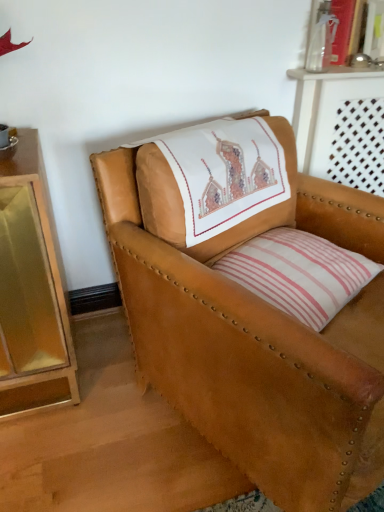
Find the location of a particular element. tan leather chair at center is located at coordinates (x=254, y=333).

Describe the element at coordinates (254, 333) in the screenshot. This screenshot has width=384, height=512. I see `tan leather chair at center` at that location.

Describe the element at coordinates (299, 273) in the screenshot. I see `white striped pillow at center` at that location.

Where is `white striped pillow at center`? white striped pillow at center is located at coordinates (299, 273).

Find the location of `tan leather chair at center`. tan leather chair at center is located at coordinates (254, 333).

Considering the relative positions of white striped pillow at center and tan leather chair at center in the image provided, is white striped pillow at center to the left of tan leather chair at center from the viewer's perspective?

In fact, white striped pillow at center is to the right of tan leather chair at center.

Between white striped pillow at center and tan leather chair at center, which one is positioned in front?

tan leather chair at center is more forward.

Which is in front, point (358, 287) or point (289, 361)?

Positioned in front is point (289, 361).

From the image's perspective, is white striped pillow at center located beneath tan leather chair at center?

No, from the image's perspective, white striped pillow at center is not beneath tan leather chair at center.

In the scene shown: From a real-world perspective, which is physically below, white striped pillow at center or tan leather chair at center?

tan leather chair at center, from a real-world perspective.

Considering the sizes of objects white striped pillow at center and tan leather chair at center in the image provided, who is thinner, white striped pillow at center or tan leather chair at center?

With smaller width is white striped pillow at center.

Does white striped pillow at center have a lesser height compared to tan leather chair at center?

Yes, white striped pillow at center is shorter than tan leather chair at center.

Looking at the image, does white striped pillow at center seem bigger or smaller compared to tan leather chair at center?

In the image, white striped pillow at center appears to be smaller than tan leather chair at center.

In the scene shown: Is white striped pillow at center positioned beyond the bounds of tan leather chair at center?

That's incorrect, white striped pillow at center is not completely outside tan leather chair at center.

Is white striped pillow at center next to tan leather chair at center and touching it?

No, white striped pillow at center is not touching tan leather chair at center.

Is white striped pillow at center oriented towards tan leather chair at center?

Yes, white striped pillow at center is aimed at tan leather chair at center.

This screenshot has height=512, width=384. Find the location of `pillow on the right of tan leather chair at center`. pillow on the right of tan leather chair at center is located at coordinates click(x=299, y=273).

In the image, is tan leather chair at center on the left side or the right side of white striped pillow at center?

Based on their positions, tan leather chair at center is located to the left of white striped pillow at center.

Is tan leather chair at center further to the viewer compared to white striped pillow at center?

No, tan leather chair at center is in front of white striped pillow at center.

Which is closer, (261, 312) or (312, 268)?

Point (261, 312) is positioned closer to the camera compared to point (312, 268).

From the image's perspective, is tan leather chair at center above white striped pillow at center?

No, from the image's perspective, tan leather chair at center is not above white striped pillow at center.

From a real-world perspective, is tan leather chair at center physically located above or below white striped pillow at center?

tan leather chair at center is situated lower than white striped pillow at center in the real world.

Can you confirm if tan leather chair at center is thinner than white striped pillow at center?

Incorrect, the width of tan leather chair at center is not less than that of white striped pillow at center.

Who is taller, tan leather chair at center or white striped pillow at center?

tan leather chair at center is taller.

Can you confirm if tan leather chair at center is bigger than white striped pillow at center?

Correct, tan leather chair at center is larger in size than white striped pillow at center.

Would you say tan leather chair at center is outside white striped pillow at center?

Yes.

Are tan leather chair at center and white striped pillow at center far apart?

They are positioned close to each other.

Consider the image. Is tan leather chair at center aimed at white striped pillow at center?

Yes, tan leather chair at center is turned towards white striped pillow at center.

How far apart are tan leather chair at center and white striped pillow at center?

tan leather chair at center is 6.47 inches from white striped pillow at center.

Locate an element on the screen. chair in front of the white striped pillow at center is located at coordinates (254, 333).

The width and height of the screenshot is (384, 512). What are the coordinates of `pillow that is behind the tan leather chair at center` in the screenshot? It's located at (299, 273).

I want to click on pillow above the tan leather chair at center (from the image's perspective), so pyautogui.click(x=299, y=273).